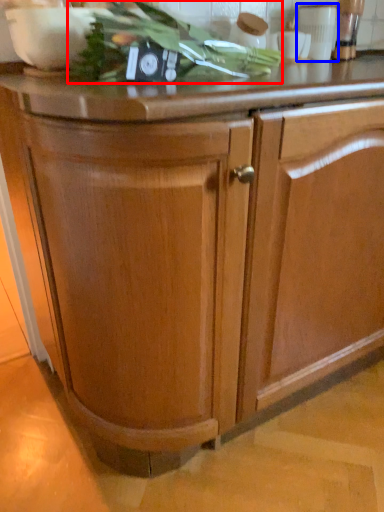
Question: Which object is closer to the camera taking this photo, vegetable (highlighted by a red box) or appliance (highlighted by a blue box)?

Choices:
 (A) vegetable
 (B) appliance

Answer: (A)